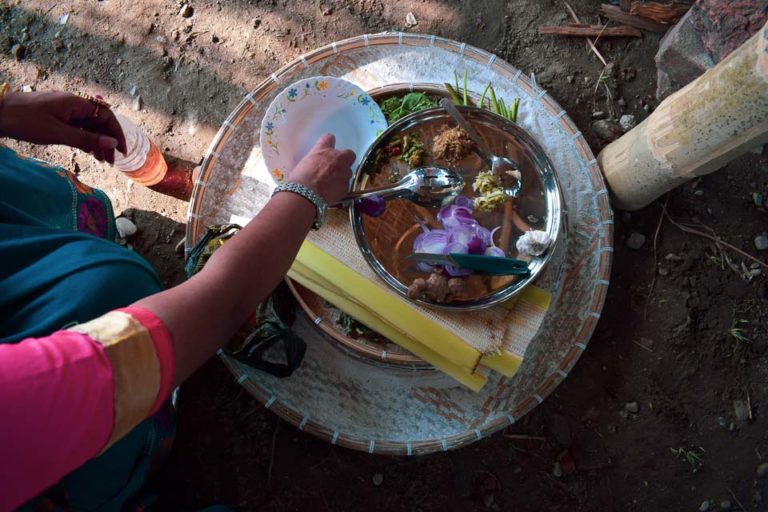
This screenshot has height=512, width=768. Find the location of `spoon`. spoon is located at coordinates (421, 185).